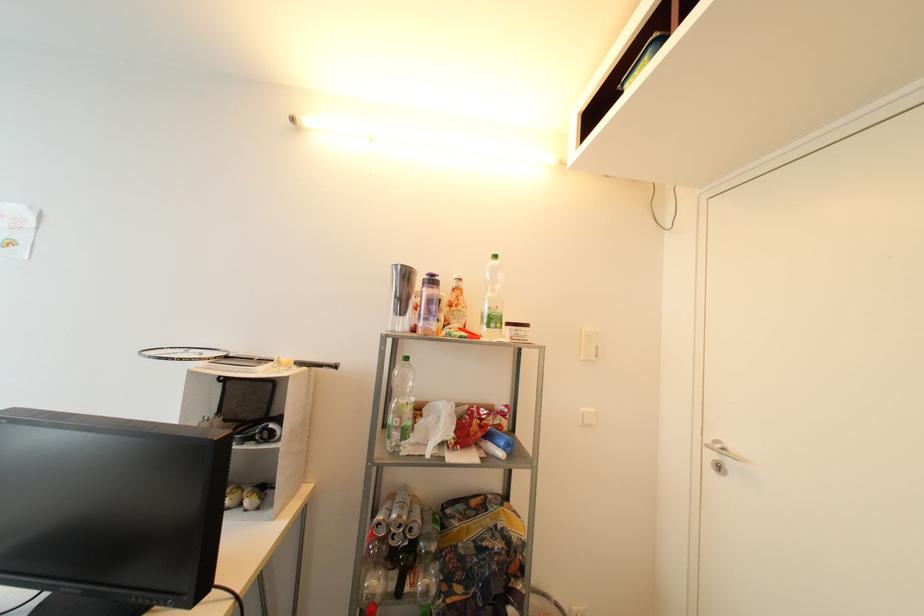
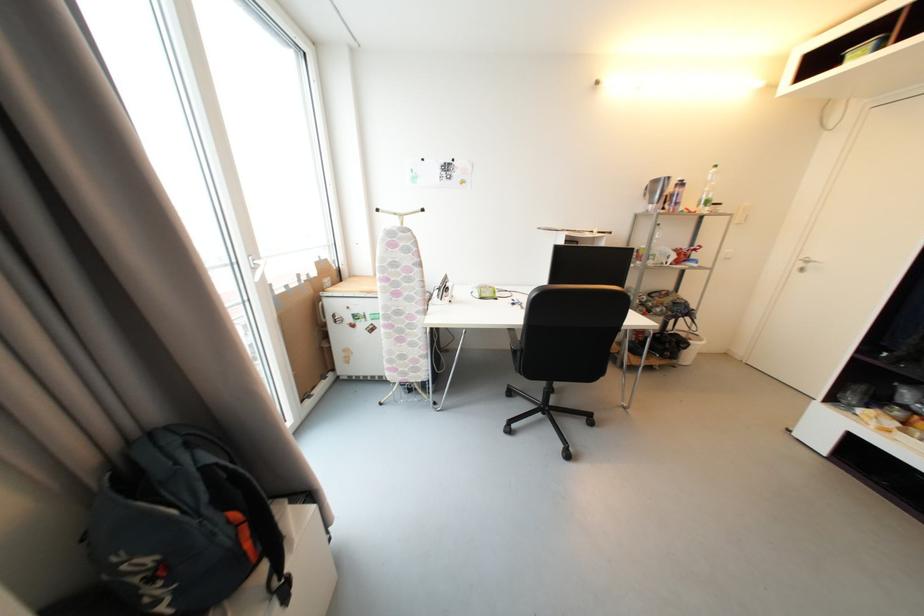
In the second image, find the point that corresponds to (x=716, y=456) in the first image.

(806, 267)